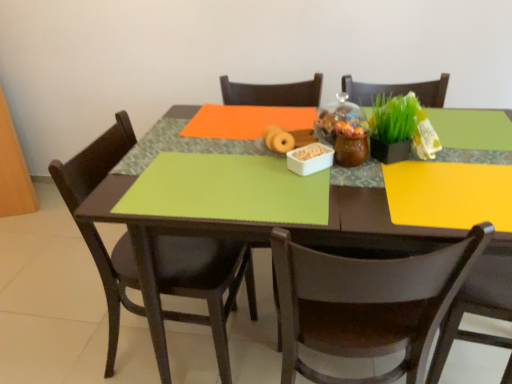
Identify the location of blank space above green matte placemat at center (from a real-world perspective). (323, 165).